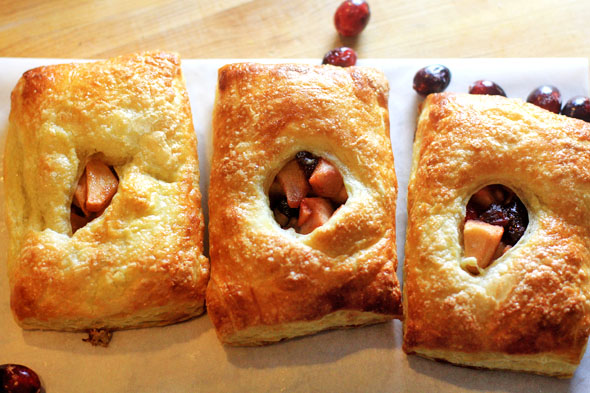
The image size is (590, 393). What are the coordinates of `darker wood grain` in the screenshot? It's located at (19, 40).